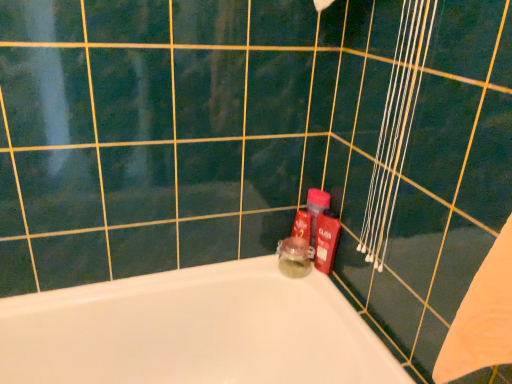
This screenshot has height=384, width=512. Find the location of `free space in front of translucent glass jar at center, acting as the 1th toiletry starting from the left`. free space in front of translucent glass jar at center, acting as the 1th toiletry starting from the left is located at coordinates (324, 302).